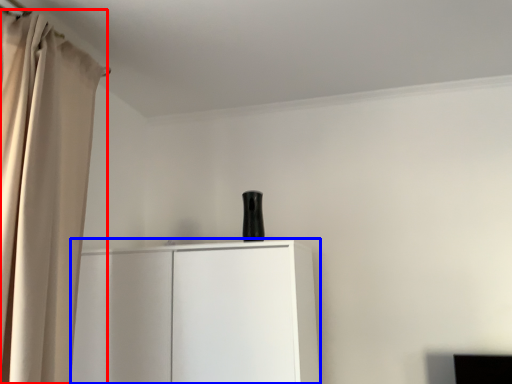
Question: Which object appears farthest to the camera in this image, curtain (highlighted by a red box) or cupboard (highlighted by a blue box)?

Choices:
 (A) curtain
 (B) cupboard

Answer: (B)